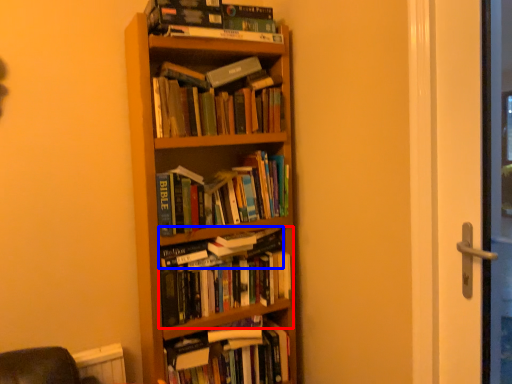
Question: Which object appears closest to the camera in this image, book (highlighted by a red box) or book (highlighted by a blue box)?

Choices:
 (A) book
 (B) book

Answer: (A)